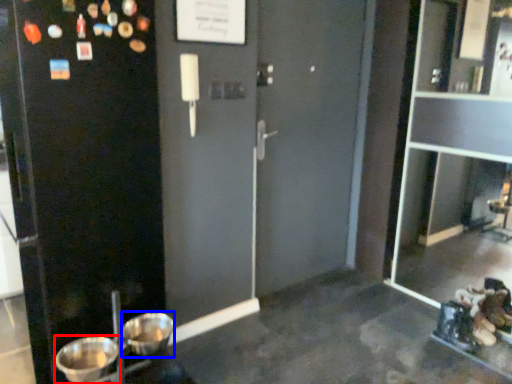
Question: Among these objects, which one is farthest to the camera, basin (highlighted by a red box) or basin (highlighted by a blue box)?

Choices:
 (A) basin
 (B) basin

Answer: (B)